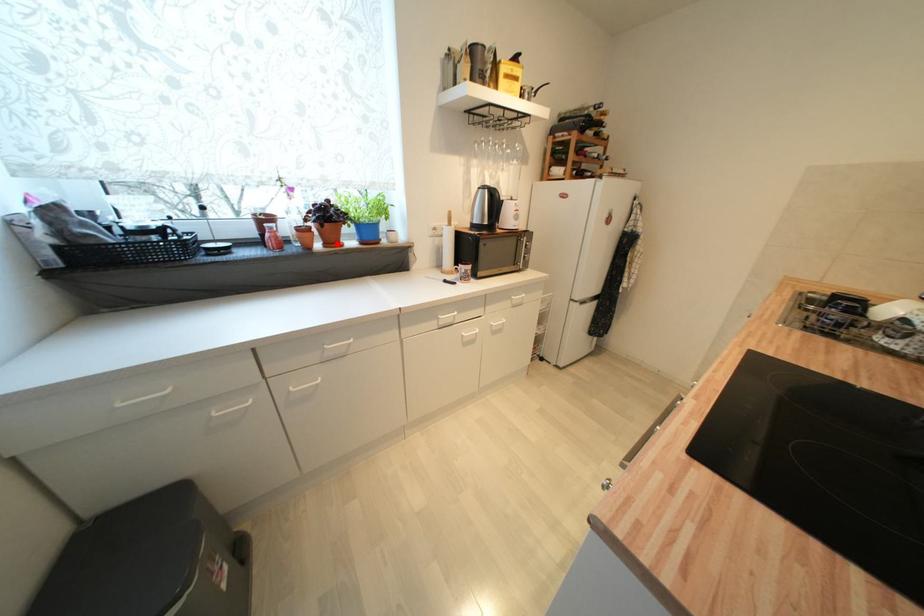
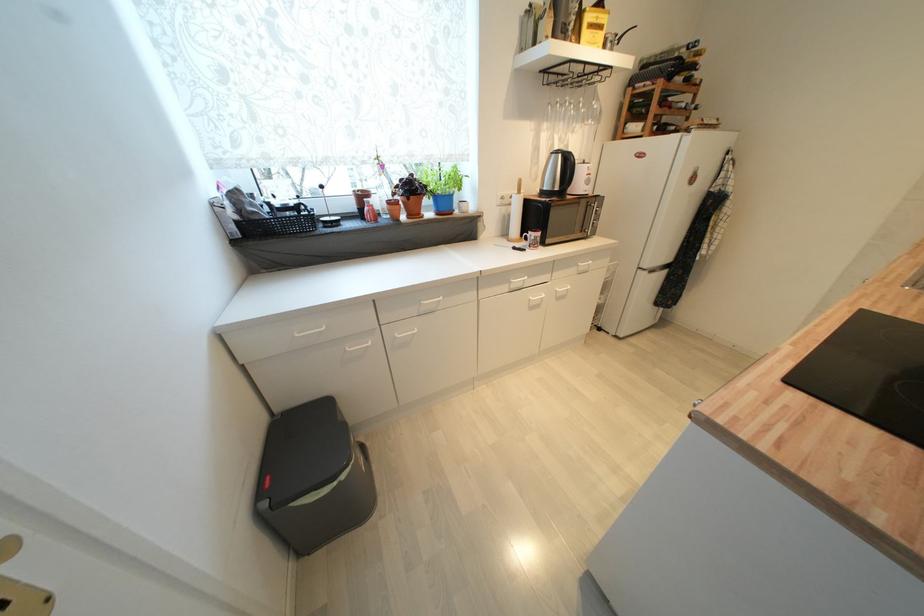
Where in the second image is the point corresponding to the highlighted location from the first image?

(419, 216)